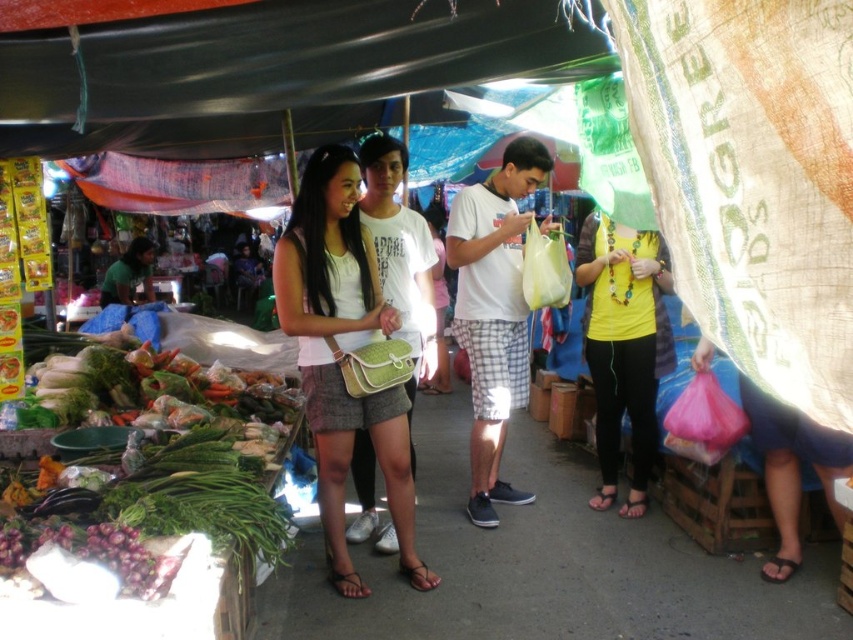
Is the position of green leafy vegetables at left more distant than that of matte white tank top at center?

That is False.

Which is more to the right, green leafy vegetables at left or matte white tank top at center?

Positioned to the right is matte white tank top at center.

Is point (59, 477) closer to viewer compared to point (328, 440)?

Yes, it is.

Locate an element on the screen. green leafy vegetables at left is located at coordinates (151, 461).

This screenshot has width=853, height=640. Describe the element at coordinates (151, 461) in the screenshot. I see `green leafy vegetables at left` at that location.

Does green leafy vegetables at left appear on the right side of matte green purse at center?

Incorrect, green leafy vegetables at left is not on the right side of matte green purse at center.

Locate an element on the screen. Image resolution: width=853 pixels, height=640 pixels. green leafy vegetables at left is located at coordinates (151, 461).

Image resolution: width=853 pixels, height=640 pixels. I want to click on green leafy vegetables at left, so click(x=151, y=461).

Describe the element at coordinates (492, 310) in the screenshot. This screenshot has width=853, height=640. I see `white matte plastic bag at center` at that location.

Between point (489, 200) and point (624, 349), which one is positioned in front?

Point (624, 349)

This screenshot has height=640, width=853. Find the location of `white matte plastic bag at center`. white matte plastic bag at center is located at coordinates (492, 310).